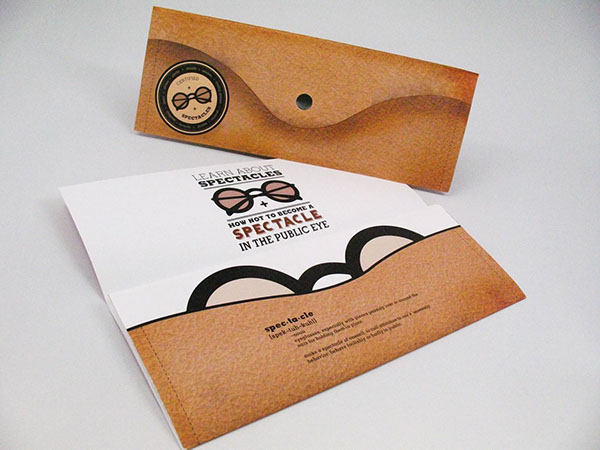
At what (x,y) coordinates should I click in order to perform the action: click on fake leather pattern. Please return your answer as a coordinate pair (x, y). This screenshot has width=600, height=450. Looking at the image, I should click on (394, 138), (242, 132), (253, 49), (365, 68).